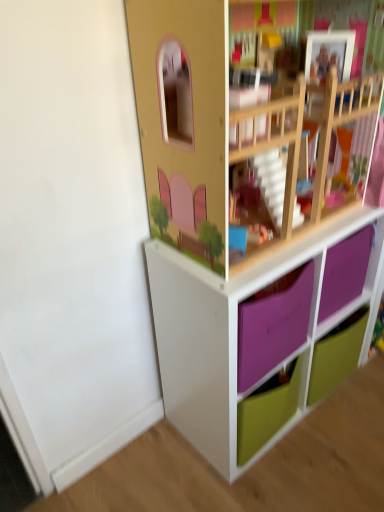
You are a GUI agent. You are given a task and a screenshot of the screen. Output one action in this format:
    pyautogui.click(x=<x>, y=<y>)
    Task: Click on the white matte storage unit at lower right
    
    Given the screenshot: What is the action you would take?
    pyautogui.click(x=249, y=222)

Image resolution: width=384 pixels, height=512 pixels. What do you see at coordinates (249, 222) in the screenshot?
I see `white matte storage unit at lower right` at bounding box center [249, 222].

You are a GUI agent. You are given a task and a screenshot of the screen. Output one action in this format:
    pyautogui.click(x=<x>, y=<y>)
    Task: Click on the green matte drawer at lower right
    
    Given the screenshot: What is the action you would take?
    pyautogui.click(x=336, y=355)

This screenshot has height=512, width=384. What do you see at coordinates (336, 355) in the screenshot?
I see `green matte drawer at lower right` at bounding box center [336, 355].

At what (x,y) coordinates should I click in order to perform the action: click on white matte storage unit at lower right. Please return your answer as a coordinate pair (x, y). Looking at the image, I should click on (249, 222).

Which is more to the left, green matte drawer at lower right or white matte storage unit at lower right?

white matte storage unit at lower right.

Is green matte drawer at lower right in front of or behind white matte storage unit at lower right in the image?

green matte drawer at lower right is behind white matte storage unit at lower right.

Considering the points (326, 382) and (175, 262), which point is behind, point (326, 382) or point (175, 262)?

Positioned behind is point (326, 382).

Looking at this image, from the image's perspective, relative to white matte storage unit at lower right, is green matte drawer at lower right above or below?

green matte drawer at lower right is below white matte storage unit at lower right.

In the scene shown: From a real-world perspective, relative to white matte storage unit at lower right, is green matte drawer at lower right vertically above or below?

Clearly, from a real-world perspective, green matte drawer at lower right is below white matte storage unit at lower right.

Which of these two, green matte drawer at lower right or white matte storage unit at lower right, is thinner?

With smaller width is green matte drawer at lower right.

Considering the sizes of green matte drawer at lower right and white matte storage unit at lower right in the image, is green matte drawer at lower right taller or shorter than white matte storage unit at lower right?

Clearly, green matte drawer at lower right is shorter compared to white matte storage unit at lower right.

Considering the relative sizes of green matte drawer at lower right and white matte storage unit at lower right in the image provided, is green matte drawer at lower right smaller than white matte storage unit at lower right?

Yes.

Is green matte drawer at lower right outside of white matte storage unit at lower right?

No, most part of green matte drawer at lower right lies within white matte storage unit at lower right.

Are green matte drawer at lower right and white matte storage unit at lower right beside each other?

No, green matte drawer at lower right is not with white matte storage unit at lower right.

Consider the image. Is white matte storage unit at lower right at the back of green matte drawer at lower right?

Absolutely, green matte drawer at lower right is directed away from white matte storage unit at lower right.

Find the location of a particular element. drawer below the white matte storage unit at lower right (from the image's perspective) is located at coordinates (336, 355).

Considering the relative positions of white matte storage unit at lower right and green matte drawer at lower right in the image provided, is white matte storage unit at lower right to the right of green matte drawer at lower right from the viewer's perspective?

In fact, white matte storage unit at lower right is to the left of green matte drawer at lower right.

Is white matte storage unit at lower right further to camera compared to green matte drawer at lower right?

No, it is not.

Is point (185, 49) behind point (348, 360)?

No, it is in front of (348, 360).

From the image's perspective, is white matte storage unit at lower right over green matte drawer at lower right?

Yes, from the image's perspective, white matte storage unit at lower right is over green matte drawer at lower right.

From a real-world perspective, is white matte storage unit at lower right positioned above or below green matte drawer at lower right?

white matte storage unit at lower right is situated higher than green matte drawer at lower right in the real world.

Which of these two, white matte storage unit at lower right or green matte drawer at lower right, is thinner?

green matte drawer at lower right.

Considering the sizes of white matte storage unit at lower right and green matte drawer at lower right in the image, is white matte storage unit at lower right taller or shorter than green matte drawer at lower right?

Clearly, white matte storage unit at lower right is taller compared to green matte drawer at lower right.

Is white matte storage unit at lower right smaller than green matte drawer at lower right?

Actually, white matte storage unit at lower right might be larger than green matte drawer at lower right.

Choose the correct answer: Is white matte storage unit at lower right inside green matte drawer at lower right or outside it?

white matte storage unit at lower right is outside green matte drawer at lower right.

Is white matte storage unit at lower right directly adjacent to green matte drawer at lower right?

No, white matte storage unit at lower right is not with green matte drawer at lower right.

Is white matte storage unit at lower right facing away from green matte drawer at lower right?

Yes, green matte drawer at lower right is at the back of white matte storage unit at lower right.

How many degrees apart are the facing directions of white matte storage unit at lower right and green matte drawer at lower right?

0.475 degrees.

Measure the distance between white matte storage unit at lower right and green matte drawer at lower right.

They are 16.14 inches apart.

Find the location of `shelf above the green matte drawer at lower right (from the image's perspective)`. shelf above the green matte drawer at lower right (from the image's perspective) is located at coordinates (249, 222).

The height and width of the screenshot is (512, 384). In order to click on shelf on the left of the green matte drawer at lower right in this screenshot , I will do `click(249, 222)`.

Identify the location of drawer that appears behind the white matte storage unit at lower right. The height and width of the screenshot is (512, 384). (336, 355).